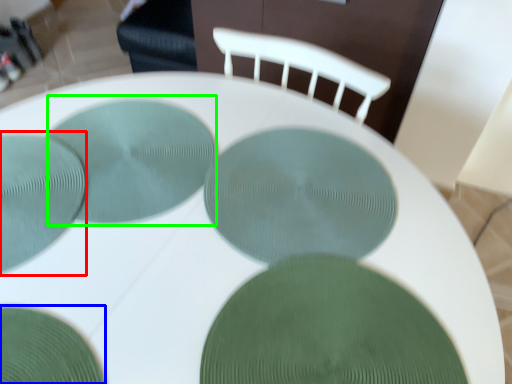
Question: Which object is the closest to the glass plate (highlighted by a red box)? Choose among these: glass plate (highlighted by a blue box) or glass plate (highlighted by a green box).

Choices:
 (A) glass plate
 (B) glass plate

Answer: (B)